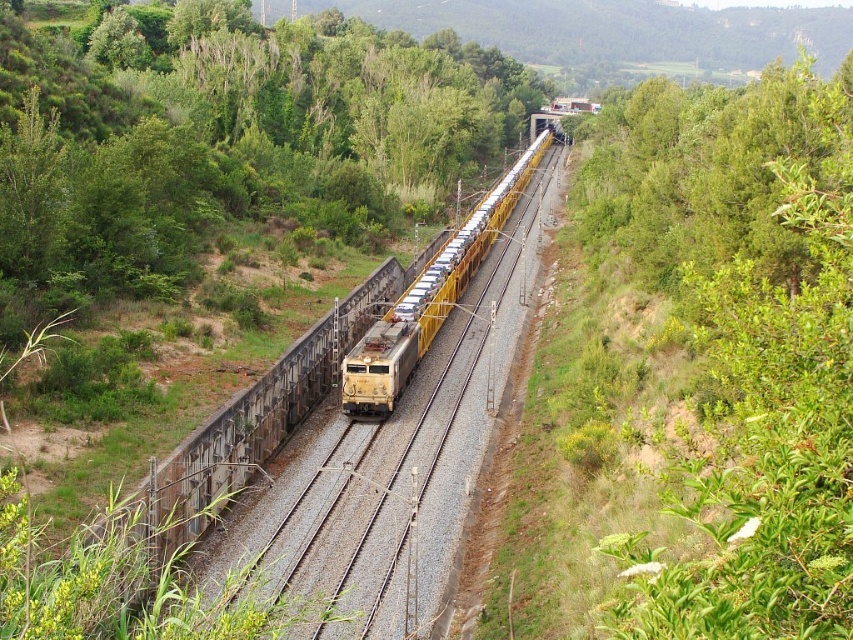
Question: Is yellow metal train tracks at center to the right of yellow metallic train at center from the viewer's perspective?

Choices:
 (A) no
 (B) yes

Answer: (A)

Question: Which point is closer to the camera?

Choices:
 (A) yellow metallic locomotive at center
 (B) yellow metallic train at center

Answer: (A)

Question: Can you confirm if yellow metallic train at center is positioned to the left of yellow metallic locomotive at center?

Choices:
 (A) no
 (B) yes

Answer: (A)

Question: Is yellow metallic train at center positioned in front of yellow metallic locomotive at center?

Choices:
 (A) no
 (B) yes

Answer: (A)

Question: Which object appears closest to the camera in this image?

Choices:
 (A) yellow metallic locomotive at center
 (B) yellow metallic train at center
 (C) yellow metal train tracks at center

Answer: (C)

Question: Which point is farther to the camera?

Choices:
 (A) yellow metallic locomotive at center
 (B) yellow metallic train at center

Answer: (B)